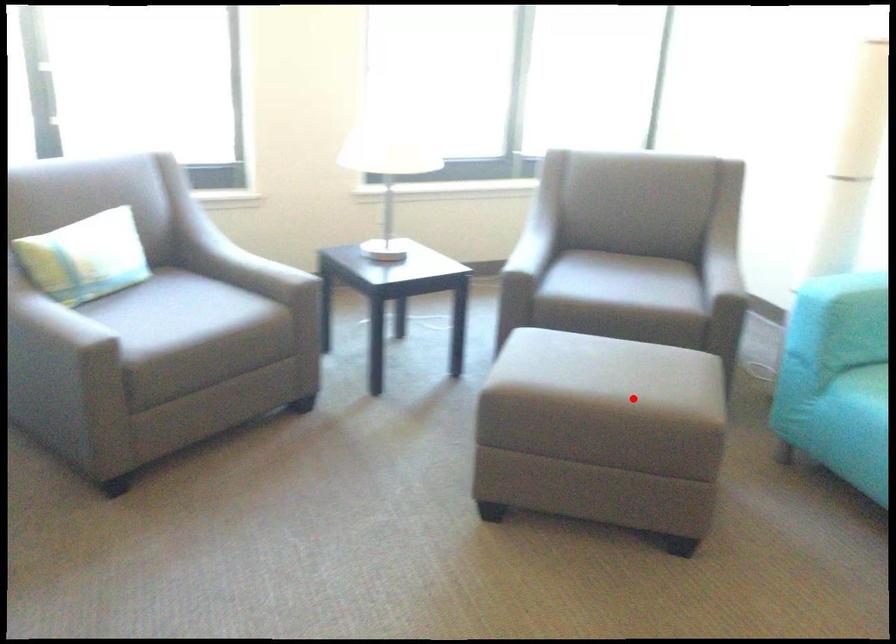
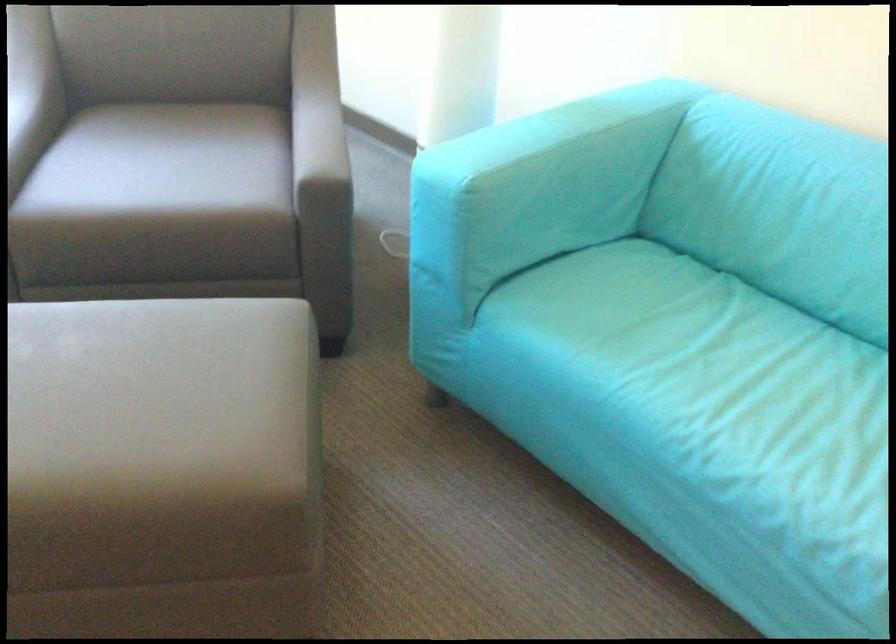
In the second image, find the point that corresponds to the highlighted location in the first image.

(162, 469)